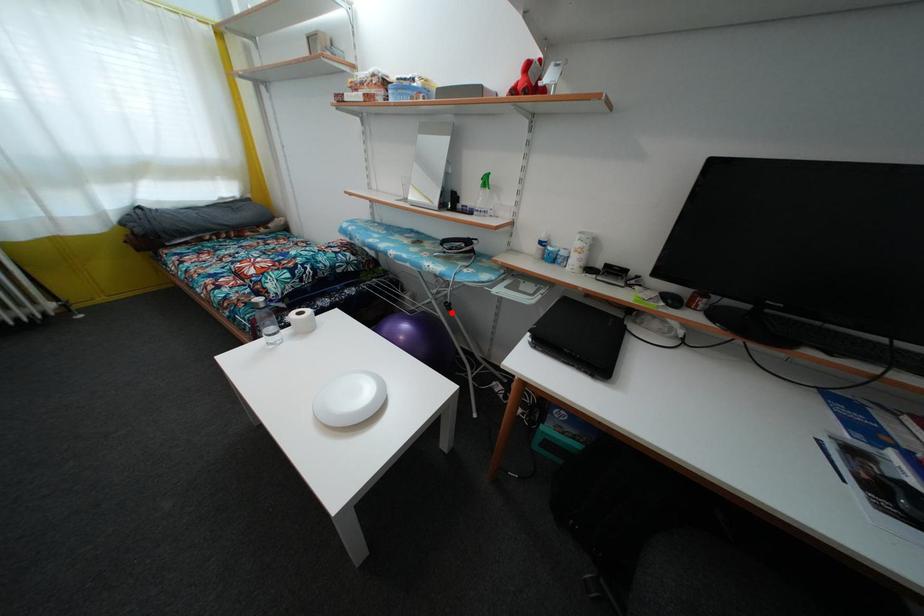
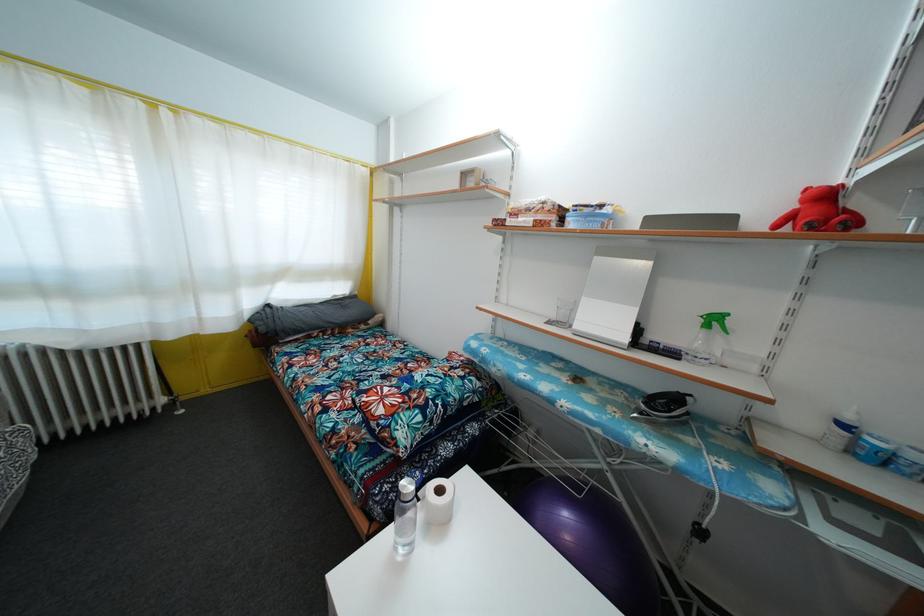
Where in the second image is the point corresponding to the highlighted location from the first image?

(704, 540)